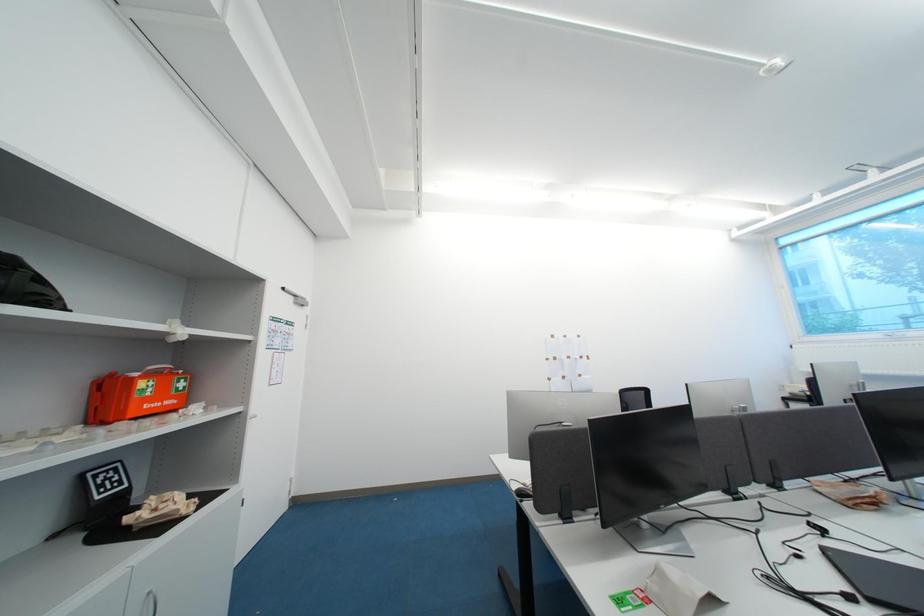
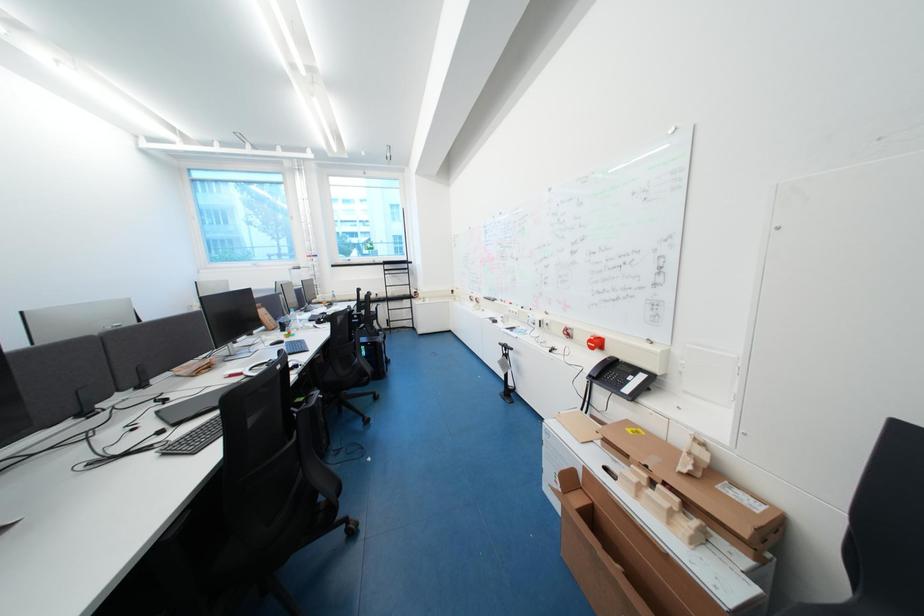
Question: The images are taken continuously from a first-person perspective. In which direction is your viewpoint rotating?

Choices:
 (A) Left
 (B) Right
 (C) Up
 (D) Down

Answer: (B)